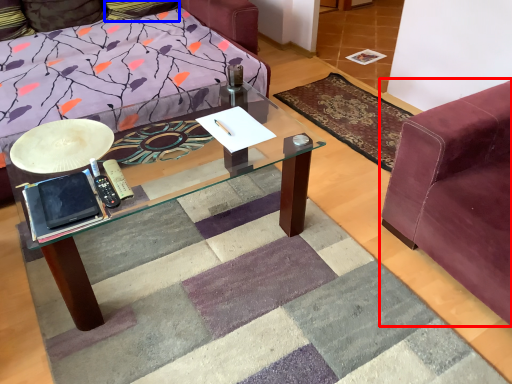
Question: Which object is further to the camera taking this photo, studio couch (highlighted by a red box) or pillow (highlighted by a blue box)?

Choices:
 (A) studio couch
 (B) pillow

Answer: (B)